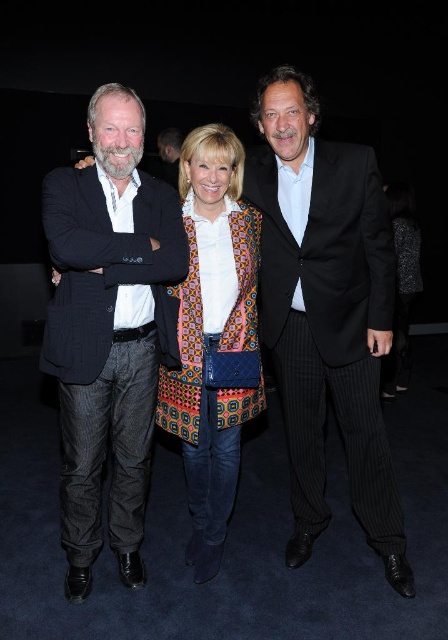
You are a photographer at a formal event and need to adjust the camera focus to ensure both the dark blue pinstripe suit at left and the patterned fabric coat at center are clearly visible. Given their height difference, which one should you focus on first to ensure proper depth of field?

The dark blue pinstripe suit at left is much taller than the patterned fabric coat at center, so focusing on the taller subject first will help achieve proper depth of field for both.

You are at a formal event and need to find the black pinstripe suit at center and the dark blue pinstripe suit at left. Which one is located to the right of the other?

The black pinstripe suit at center is positioned on the right side of dark blue pinstripe suit at left.

You are taking a photo of the scene and want to focus on both point [153,362] and point [228,294]. Which point should you focus on first to ensure both are in sharp focus?

You should focus on point [153,362] first because it is closer to the camera than point [228,294], ensuring both points will be in focus when using depth of field appropriately.